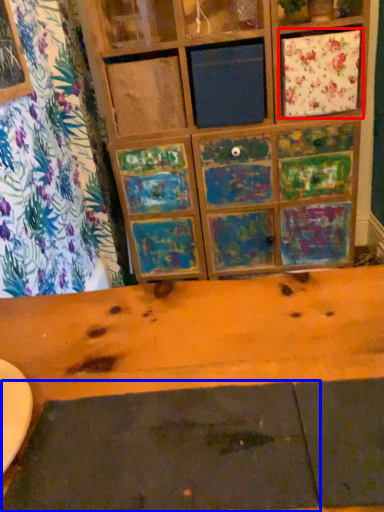
Question: Which of the following is the farthest to the observer, cabinetry (highlighted by a red box) or plank (highlighted by a blue box)?

Choices:
 (A) cabinetry
 (B) plank

Answer: (A)